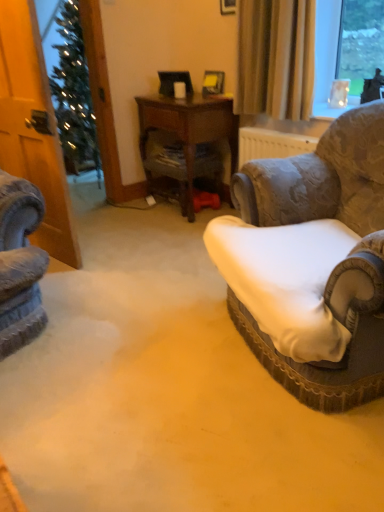
Locate an element on the screen. beige fabric curtain at upper right is located at coordinates (276, 58).

What do you see at coordinates (312, 263) in the screenshot? I see `velvet-patterned armchair at right` at bounding box center [312, 263].

Find the location of a particular element. The height and width of the screenshot is (512, 384). velvet-patterned armchair at right is located at coordinates (312, 263).

Locate an element on the screen. white fabric cushion at right is located at coordinates (169, 409).

Could you tell me if wooden desk at center is turned towards velvet-patterned armchair at right?

No, wooden desk at center is not oriented towards velvet-patterned armchair at right.

From a real-world perspective, is wooden desk at center under velvet-patterned armchair at right?

Correct, in the physical world, wooden desk at center is lower than velvet-patterned armchair at right.

Between point (223, 102) and point (271, 297), which one is positioned behind?

The point (223, 102) is farther from the camera.

Consider the image. Does wooden desk at center have a lesser width compared to velvet-patterned armchair at right?

Yes, wooden desk at center is thinner than velvet-patterned armchair at right.

Would you say wooden desk at center is a long distance from white fabric cushion at right?

Indeed, wooden desk at center is not near white fabric cushion at right.

From a real-world perspective, is wooden desk at center on white fabric cushion at right?

Yes, from a real-world perspective, wooden desk at center is over white fabric cushion at right

Considering the relative sizes of wooden desk at center and white fabric cushion at right in the image provided, is wooden desk at center wider than white fabric cushion at right?

No.

Is velvet-patterned armchair at right not close to white fabric cushion at right?

No, velvet-patterned armchair at right is not far from white fabric cushion at right.

From a real-world perspective, is velvet-patterned armchair at right positioned over white fabric cushion at right based on gravity?

Yes, from a real-world perspective, velvet-patterned armchair at right is on top of white fabric cushion at right.

Locate an element on the screen. plain below the velvet-patterned armchair at right (from a real-world perspective) is located at coordinates (169, 409).

From the image's perspective, is white fabric cushion at right under beige fabric curtain at upper right?

Yes.

What are the coordinates of `plain below the beige fabric curtain at upper right (from the image's perspective)` in the screenshot? It's located at (169, 409).

Is white fabric cushion at right to the left of beige fabric curtain at upper right from the viewer's perspective?

Correct, you'll find white fabric cushion at right to the left of beige fabric curtain at upper right.

Between white fabric cushion at right and wooden desk at center, which one appears on the left side from the viewer's perspective?

white fabric cushion at right is more to the left.

Based on the photo, which of these two, white fabric cushion at right or wooden desk at center, is thinner?

wooden desk at center is thinner.

Is white fabric cushion at right facing towards wooden desk at center?

No.

Between white fabric cushion at right and wooden desk at center, which one has larger size?

Bigger between the two is white fabric cushion at right.

Is there a large distance between wooden desk at center and beige fabric curtain at upper right?

No, there isn't a large distance between wooden desk at center and beige fabric curtain at upper right.

Does point (229, 124) appear closer or farther from the camera than point (250, 9)?

Point (229, 124).

From a real-world perspective, does wooden desk at center stand above beige fabric curtain at upper right?

No, from a real-world perspective, wooden desk at center is not on top of beige fabric curtain at upper right.

From the image's perspective, is wooden desk at center under beige fabric curtain at upper right?

Yes.

Between velvet-patterned armchair at right and wooden desk at center, which one has smaller size?

wooden desk at center.

Considering the positions of objects velvet-patterned armchair at right and wooden desk at center in the image provided, who is in front, velvet-patterned armchair at right or wooden desk at center?

velvet-patterned armchair at right is in front.

Is velvet-patterned armchair at right oriented towards wooden desk at center?

No, velvet-patterned armchair at right is not oriented towards wooden desk at center.

Locate an element on the screen. The width and height of the screenshot is (384, 512). desk above the velvet-patterned armchair at right (from the image's perspective) is located at coordinates pyautogui.click(x=191, y=126).

At what (x,y) coordinates should I click in order to perform the action: click on plain located below the wooden desk at center (from the image's perspective). Please return your answer as a coordinate pair (x, y). Looking at the image, I should click on (169, 409).

Which object lies further to the anchor point wooden desk at center, beige fabric curtain at upper right or white fabric cushion at right?

white fabric cushion at right is positioned further to the anchor wooden desk at center.

When comparing their distances from velvet-patterned armchair at right, does beige fabric curtain at upper right or wooden desk at center seem further?

Based on the image, wooden desk at center appears to be further to velvet-patterned armchair at right.

Based on their spatial positions, is beige fabric curtain at upper right or white fabric cushion at right further from velvet-patterned armchair at right?

Based on the image, beige fabric curtain at upper right appears to be further to velvet-patterned armchair at right.

Looking at this image, which object lies further to the anchor point velvet-patterned armchair at right, wooden desk at center or beige fabric curtain at upper right?

Among the two, wooden desk at center is located further to velvet-patterned armchair at right.

Based on their spatial positions, is velvet-patterned armchair at right or beige fabric curtain at upper right closer to white fabric cushion at right?

velvet-patterned armchair at right is positioned closer to the anchor white fabric cushion at right.

Looking at the image, which one is located closer to white fabric cushion at right, velvet-patterned armchair at right or wooden desk at center?

velvet-patterned armchair at right is positioned closer to the anchor white fabric cushion at right.

Considering their positions, is white fabric cushion at right positioned closer to beige fabric curtain at upper right than velvet-patterned armchair at right?

velvet-patterned armchair at right.

Considering their positions, is velvet-patterned armchair at right positioned closer to wooden desk at center than white fabric cushion at right?

velvet-patterned armchair at right is closer to wooden desk at center.

The height and width of the screenshot is (512, 384). What are the coordinates of `chair between white fabric cushion at right and wooden desk at center from front to back` in the screenshot? It's located at (312, 263).

Locate an element on the screen. This screenshot has height=512, width=384. curtain located between white fabric cushion at right and wooden desk at center in the depth direction is located at coordinates (276, 58).

The height and width of the screenshot is (512, 384). I want to click on curtain positioned between velvet-patterned armchair at right and wooden desk at center from near to far, so click(276, 58).

The image size is (384, 512). In order to click on chair located between white fabric cushion at right and beige fabric curtain at upper right in the depth direction in this screenshot , I will do [312, 263].